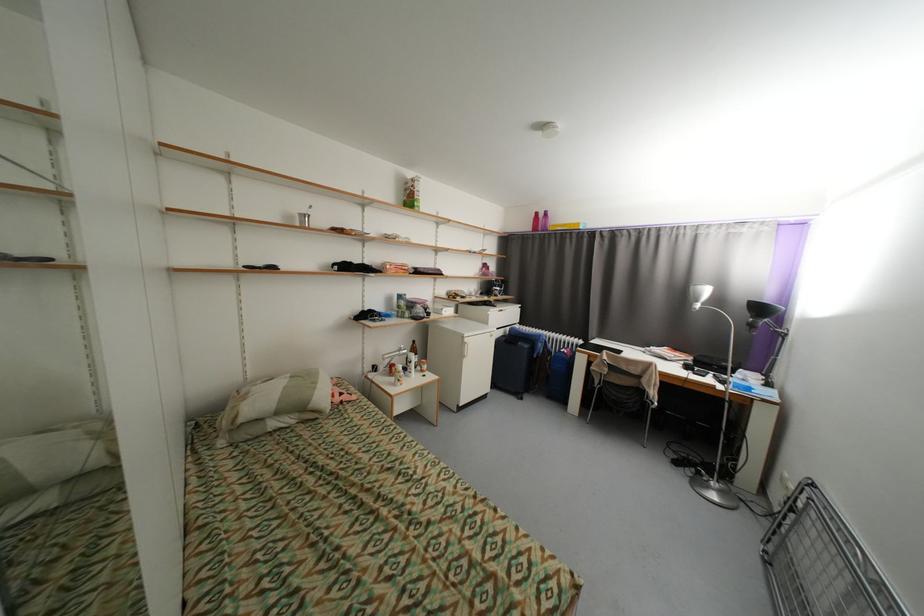
The image size is (924, 616). What do you see at coordinates (469, 347) in the screenshot? I see `the fridge door handle` at bounding box center [469, 347].